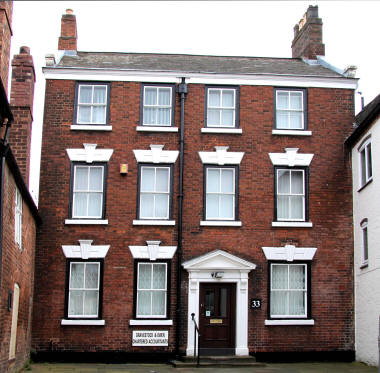
At what (x,y) coordinates should I click in order to perform the action: click on handrail. Please return your answer as a coordinate pair (x, y). Image resolution: width=380 pixels, height=373 pixels. Looking at the image, I should click on (196, 326).